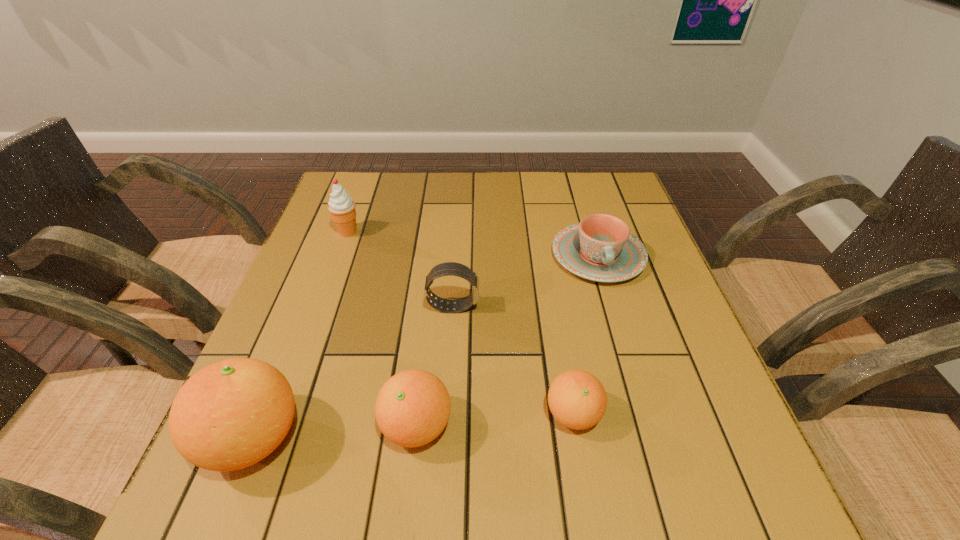
You are a GUI agent. You are given a task and a screenshot of the screen. Output one action in this format:
    pyautogui.click(x=<x>, y=<y>)
    Task: Click on the free space between the tallest orange and the second orange from left to right
    This screenshot has width=960, height=540.
    Given the screenshot: What is the action you would take?
    pyautogui.click(x=335, y=432)

Image resolution: width=960 pixels, height=540 pixels. Find the location of `free space between the leftmost orange and the second shortest orange`. free space between the leftmost orange and the second shortest orange is located at coordinates (335, 432).

Identify which object is located as the third nearest to the icecream. Please provide its 2D coordinates. Your answer should be formatted as a tuple, i.e. [(x, y)], where the tuple contains the x and y coordinates of a point satisfying the conditions above.

[(412, 408)]

Find the location of a particular element. object that is the third closest to the rightmost orange is located at coordinates (600, 248).

Where is `orange that stands as the closest to the tallest orange`? The width and height of the screenshot is (960, 540). orange that stands as the closest to the tallest orange is located at coordinates (412, 408).

Identify which orange is located as the nearest to the tallest orange. Please provide its 2D coordinates. Your answer should be formatted as a tuple, i.e. [(x, y)], where the tuple contains the x and y coordinates of a point satisfying the conditions above.

[(412, 408)]

In order to click on blank space that satisfies the following two spatial constraints: 1. on the face of the rightmost orange; 2. on the left side of the third farthest object in this screenshot , I will do `click(446, 414)`.

Locate an element on the screen. Image resolution: width=960 pixels, height=540 pixels. free space in the image that satisfies the following two spatial constraints: 1. on the handle side of the chinaware; 2. on the face of the fourth nearest object is located at coordinates (613, 307).

Image resolution: width=960 pixels, height=540 pixels. In order to click on vacant space that satisfies the following two spatial constraints: 1. on the handle side of the chinaware; 2. on the face of the third farthest object in this screenshot , I will do coord(613,307).